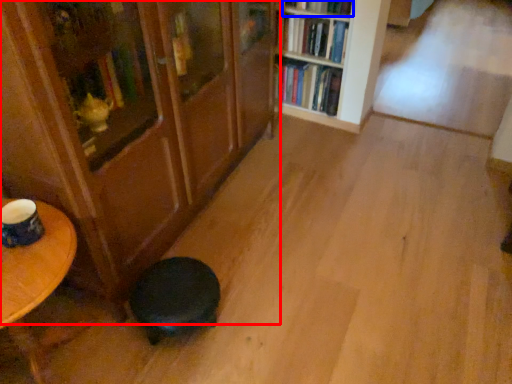
Question: Which object appears closest to the camera in this image, bookcase (highlighted by a red box) or book (highlighted by a blue box)?

Choices:
 (A) bookcase
 (B) book

Answer: (A)